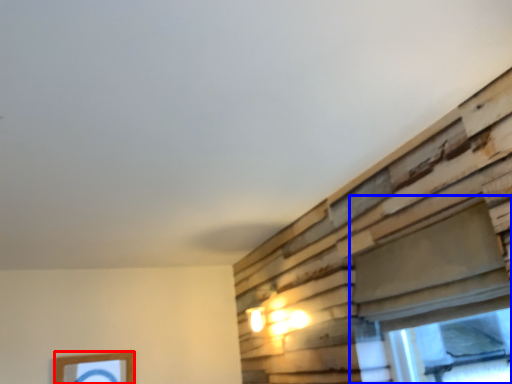
Question: Which point is closer to the camera, picture frame (highlighted by a red box) or window (highlighted by a blue box)?

Choices:
 (A) picture frame
 (B) window

Answer: (B)